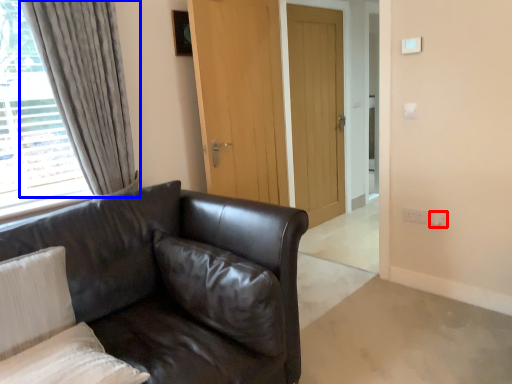
Question: Which point is further to the camera, electric outlet (highlighted by a red box) or curtain (highlighted by a blue box)?

Choices:
 (A) electric outlet
 (B) curtain

Answer: (A)